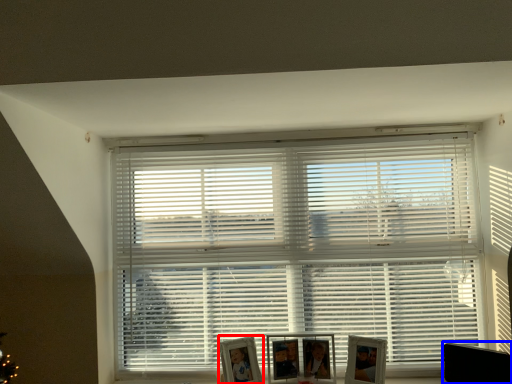
Question: Which point is further to the camera, picture frame (highlighted by a red box) or swivel chair (highlighted by a blue box)?

Choices:
 (A) picture frame
 (B) swivel chair

Answer: (A)